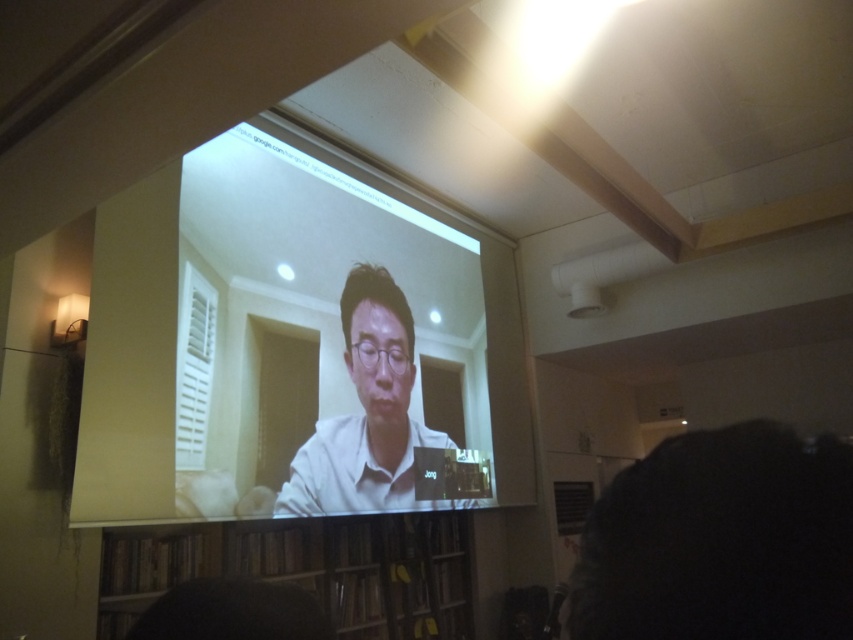
You are standing in a room with a white glossy projector screen at upper center. You want to adjust the focus of your camera to capture the screen clearly. Given that the camera requires a minimum focus distance of 6 feet, will you be able to focus on the screen?

The white glossy projector screen at upper center is 8.02 feet away from the camera, which is beyond the minimum focus distance of 6 feet. Therefore, the camera can focus on the screen.

You are setting up a video call in this room and need to position a small lamp. The lamp needs to be placed to the right of the white glossy projector screen at upper center and also to the left of the white matte shirt at center. Is there enough space between them for the lamp?

The white glossy projector screen at upper center is to the left of the white matte shirt at center, so there is space between them where the lamp can be placed to the right of the screen and to the left of the shirt.

You are setting up a video call in this room and need to place a small table between the white glossy projector screen at upper center and the brown wooden bookshelf at lower center. Can the table fit in the space between them?

The white glossy projector screen at upper center is larger in size than the brown wooden bookshelf at lower center. Since the screen is larger, the space between them might be sufficient for a small table, but the exact dimensions aren